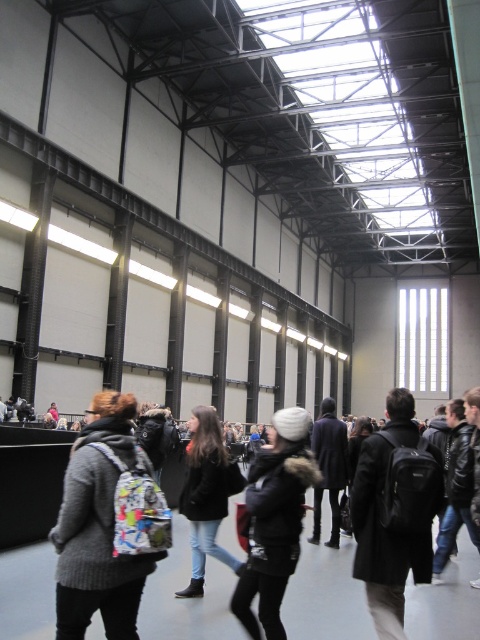
You are organizing a storage area in the building. You have a storage shelf that can only accommodate items narrower than the black fuzzy jacket at center. Can the black matte backpack at center fit on this shelf?

The black matte backpack at center is wider than the black fuzzy jacket at center, so it cannot fit on the storage shelf designed for items narrower than the black fuzzy jacket at center.

You are a photographer standing in the middle of the building. You notice a knitted gray sweater at center and a black matte backpack at center. Which object is closer to you?

The knitted gray sweater at center is closer to you because it is in front of the black matte backpack at center.

You are a photographer setting up a shoot in this industrial space. You want to ensure that both the knitted gray sweater at center and the black matte backpack at center are clearly visible in the frame. Given their sizes, which object might require you to adjust your camera angle to capture more detail?

The knitted gray sweater at center has a smaller size compared to the black matte backpack at center, so it might require adjusting the camera angle to ensure its details are captured clearly.